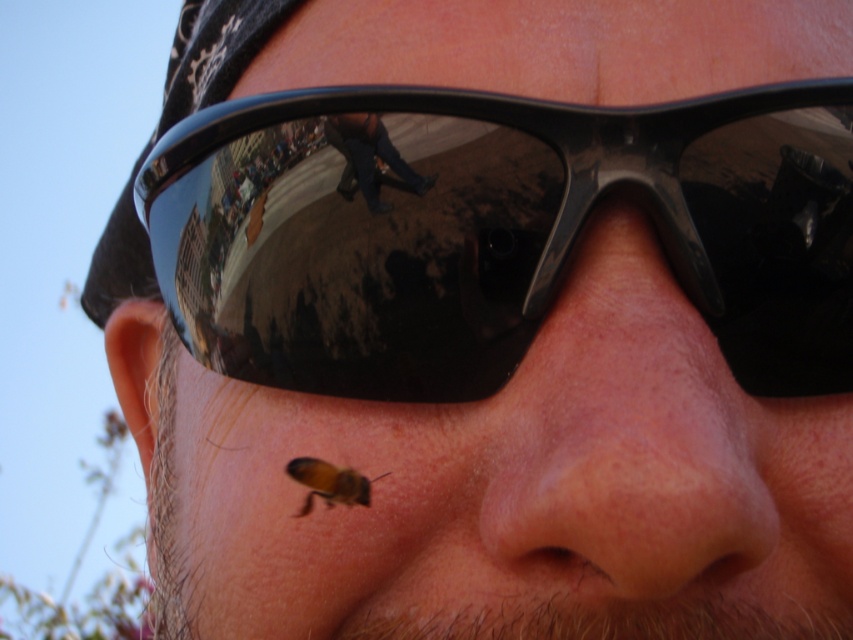
You are a photographer adjusting your camera to focus on two points on a person in the image. The points are labeled as point (830, 104) and point (354, 492). Which point is closer to your camera lens?

Point (830, 104) is further to the viewer than point (354, 492), so the point closer to the camera lens is point (354, 492).

You are a photographer trying to capture a closeup shot of a person wearing sunglasses. You notice a point on their face at coordinates point (482, 394). If the camera is positioned 13.27 inches away from this point, will the focus be sharp enough for a clear photo?

The point (482, 394) is 13.27 inches away from the camera, which is within a typical focus range for a closeup portrait. The focus should be sharp enough for a clear photo.

Based on the scene description, can you determine which object is closer to the observer between the black reflective sunglasses at upper center and the pink smooth skin at center?

The pink smooth skin at center is behind black reflective sunglasses at upper center, so the black reflective sunglasses at upper center is closer to the observer.